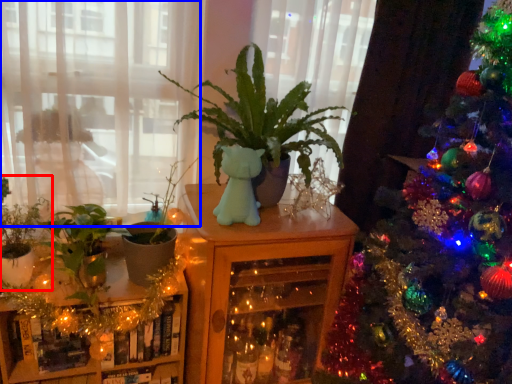
Question: Which point is closer to the camera, houseplant (highlighted by a red box) or window (highlighted by a blue box)?

Choices:
 (A) houseplant
 (B) window

Answer: (B)